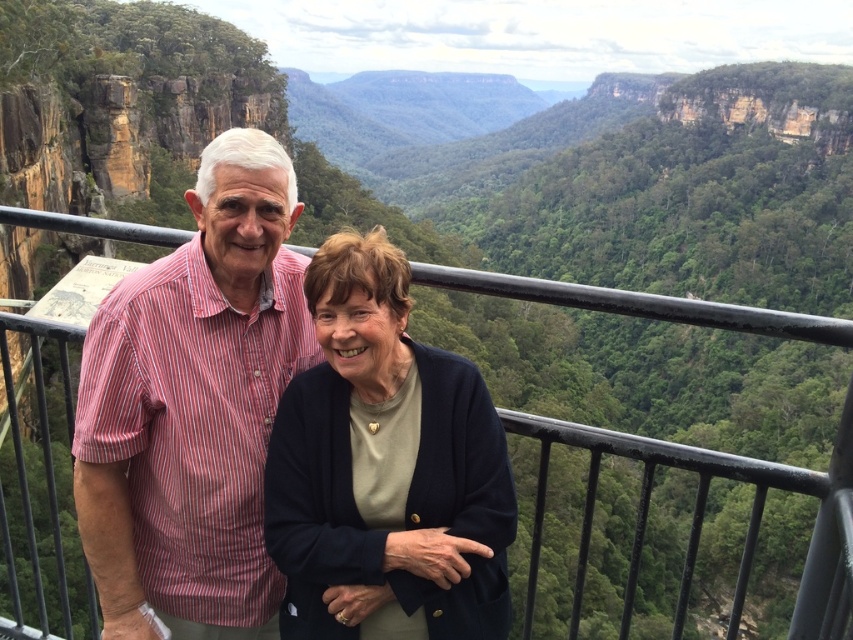
You are designing a new balcony railing that needs to be wider than the dark blue sweater at center. According to the image, is the current black metal railing at upper center wide enough for your design?

The dark blue sweater at center is narrower than the black metal railing at upper center, so the existing railing is wider than the sweater. Therefore, the black metal railing at upper center meets the requirement of being wider than the dark blue sweater at center.

You are standing on a balcony overlooking a valley and need to place a small potted plant exactly at the coordinates where the striped cotton shirt at left is located. Is this location on the balcony or over the railing?

The striped cotton shirt at left is positioned at point [194,406], which is on the balcony since the railing is behind the subjects and the coordinates fall within the balcony area.

You are a photographer trying to capture a photo of the striped cotton shirt at left without the black metal railing at upper center appearing in the frame. Is this possible based on their positions?

The black metal railing at upper center is behind the striped cotton shirt at left, so it should not appear in the frame if the photographer focuses on the shirt. The railing is positioned behind the shirt, so it would be obscured by the subject.